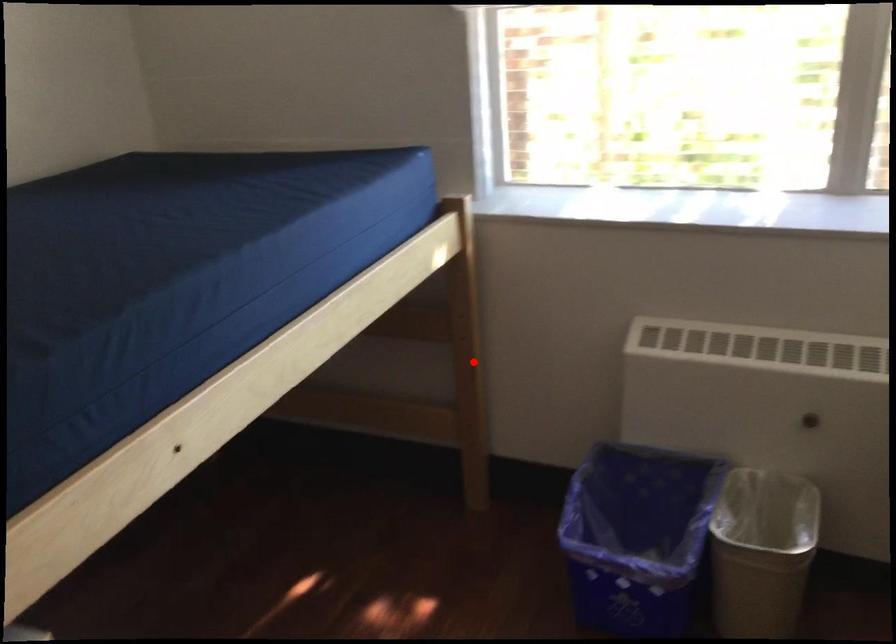
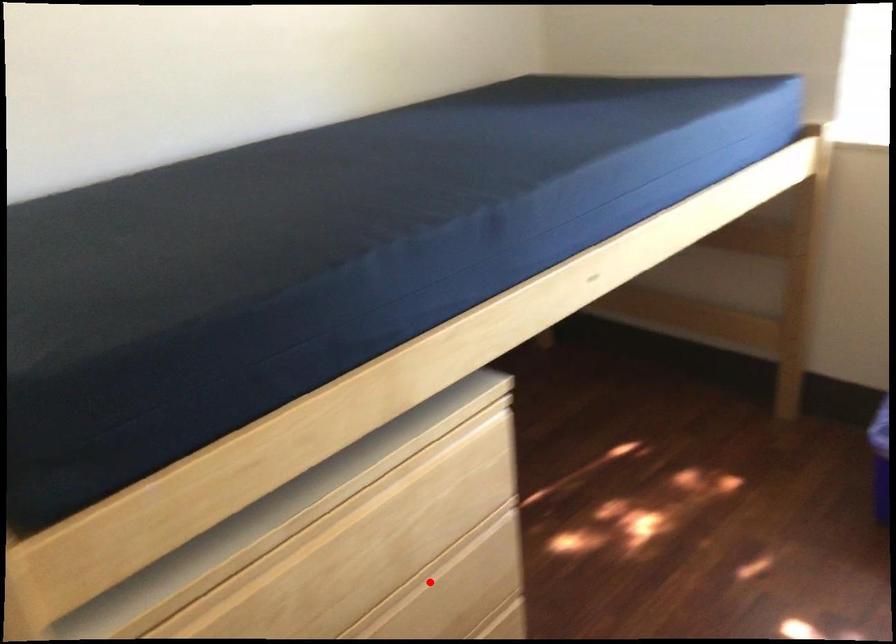
I am providing you with two images of the same scene from different viewpoints. A red point is marked on the first image and another point is marked on the second image. Is the marked point in image1 the same physical position as the marked point in image2?

No